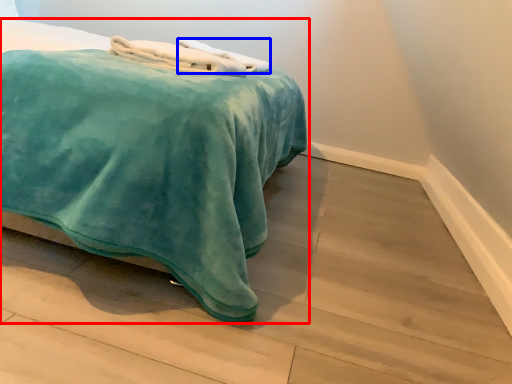
Question: Which point is closer to the camera, bed (highlighted by a red box) or bath towel (highlighted by a blue box)?

Choices:
 (A) bed
 (B) bath towel

Answer: (A)